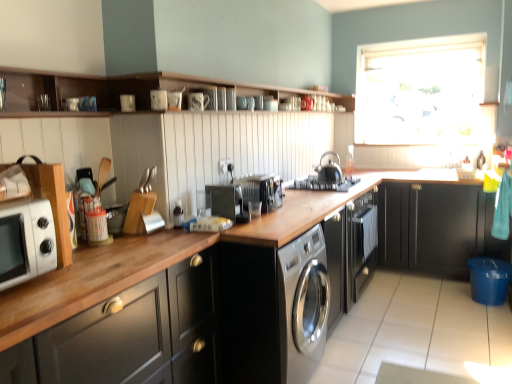
The image size is (512, 384). What do you see at coordinates (227, 203) in the screenshot?
I see `satin black coffee maker at center, positioned as the 1th appliance in front-to-back order` at bounding box center [227, 203].

Locate an element on the screen. black matte cabinet at right, the second cabinetry when ordered from top to bottom is located at coordinates pyautogui.click(x=436, y=228).

I want to click on black matte kettle at center, arranged as the third appliance when viewed from the front, so click(329, 169).

The width and height of the screenshot is (512, 384). In order to click on white glossy microwave at left in this screenshot , I will do `click(26, 241)`.

The image size is (512, 384). What do you see at coordinates (303, 305) in the screenshot?
I see `sleek stainless steel washing machine at center` at bounding box center [303, 305].

The width and height of the screenshot is (512, 384). What do you see at coordinates (50, 89) in the screenshot? I see `wooden shelf at upper left` at bounding box center [50, 89].

This screenshot has height=384, width=512. I want to click on matte wood cabinet at left, acting as the third cabinetry starting from the right, so click(130, 336).

Is black matte kettle at center, arranged as the third appliance when viewed from the left, aimed at black matte cabinet at right, positioned as the third cabinetry in left-to-right order?

No, black matte kettle at center, arranged as the third appliance when viewed from the left, is not oriented towards black matte cabinet at right, positioned as the third cabinetry in left-to-right order.

From the image's perspective, is black matte kettle at center, the first appliance from the right, above or below black matte cabinet at right, the second cabinetry when ordered from top to bottom?

From the image's perspective, black matte kettle at center, the first appliance from the right, appears above black matte cabinet at right, the second cabinetry when ordered from top to bottom.

Can you tell me how much black matte kettle at center, arranged as the third appliance when viewed from the front, and black matte cabinet at right, the second cabinetry when ordered from top to bottom, differ in facing direction?

The angle between the facing direction of black matte kettle at center, arranged as the third appliance when viewed from the front, and the facing direction of black matte cabinet at right, the second cabinetry when ordered from top to bottom, is 83 degrees.

Is wooden shelf at upper left far from satin black coffee maker at center, which is counted as the 1th appliance, starting from the left?

wooden shelf at upper left is actually quite close to satin black coffee maker at center, which is counted as the 1th appliance, starting from the left.

Find the location of a particular element. shelf that appears in front of the satin black coffee maker at center, acting as the third appliance starting from the back is located at coordinates (50, 89).

Is wooden shelf at upper left not inside satin black coffee maker at center, the 3th appliance when ordered from right to left?

wooden shelf at upper left is positioned outside satin black coffee maker at center, the 3th appliance when ordered from right to left.

I want to click on shelf that is in front of the black matte cabinet at right, acting as the second cabinetry starting from the bottom, so click(x=50, y=89).

From the image's perspective, which one is positioned lower, wooden shelf at upper left or black matte cabinet at right, positioned as the third cabinetry in left-to-right order?

From the image's view, black matte cabinet at right, positioned as the third cabinetry in left-to-right order, is below.

From the picture: Can you tell me how much wooden shelf at upper left and black matte cabinet at right, acting as the second cabinetry starting from the bottom, differ in facing direction?

They differ by 91 degrees in their facing directions.

From a real-world perspective, which object rests below the other?

matte wood cabinet at left, arranged as the 3th cabinetry when viewed from the top.

Could matte wood cabinet at left, acting as the third cabinetry starting from the right, be considered to be inside white glossy shelves at upper center, marked as the second cabinetry in a left-to-right arrangement?

That's incorrect, matte wood cabinet at left, acting as the third cabinetry starting from the right, is not inside white glossy shelves at upper center, marked as the second cabinetry in a left-to-right arrangement.

Does white glossy shelves at upper center, marked as the second cabinetry in a left-to-right arrangement, come behind matte wood cabinet at left, the 1th cabinetry from the bottom?

Yes, the depth of white glossy shelves at upper center, marked as the second cabinetry in a left-to-right arrangement, is greater than that of matte wood cabinet at left, the 1th cabinetry from the bottom.

How many degrees apart are the facing directions of white glossy shelves at upper center, arranged as the 3th cabinetry when ordered from the bottom, and matte wood cabinet at left, arranged as the 3th cabinetry when viewed from the top?

The angular difference between white glossy shelves at upper center, arranged as the 3th cabinetry when ordered from the bottom, and matte wood cabinet at left, arranged as the 3th cabinetry when viewed from the top, is 1.58 degrees.

Is white glossy shelves at upper center, acting as the first cabinetry starting from the top, positioned beyond the bounds of satin black stove at center?

Yes, white glossy shelves at upper center, acting as the first cabinetry starting from the top, is located beyond the bounds of satin black stove at center.

From a real-world perspective, is white glossy shelves at upper center, arranged as the 3th cabinetry when ordered from the bottom, above or below satin black stove at center?

In terms of real-world spatial position, white glossy shelves at upper center, arranged as the 3th cabinetry when ordered from the bottom, is above satin black stove at center.

Considering the relative sizes of matte wood cabinet at left, the 1th cabinetry from the bottom, and satin black coffee maker at center, which is counted as the 1th appliance, starting from the left, in the image provided, is matte wood cabinet at left, the 1th cabinetry from the bottom, thinner than satin black coffee maker at center, which is counted as the 1th appliance, starting from the left,?

No, matte wood cabinet at left, the 1th cabinetry from the bottom, is not thinner than satin black coffee maker at center, which is counted as the 1th appliance, starting from the left.

This screenshot has width=512, height=384. Find the location of `cabinetry that appears on the left of satin black coffee maker at center, which is counted as the 1th appliance, starting from the left`. cabinetry that appears on the left of satin black coffee maker at center, which is counted as the 1th appliance, starting from the left is located at coordinates (130, 336).

Is matte wood cabinet at left, arranged as the 3th cabinetry when viewed from the top, to the left of satin black coffee maker at center, which is counted as the 1th appliance, starting from the left, from the viewer's perspective?

Yes.

Looking at the image, does black matte kettle at center, the first appliance from the right, seem bigger or smaller compared to satin black coffee maker at center, which is counted as the 1th appliance, starting from the left?

Considering their sizes, black matte kettle at center, the first appliance from the right, takes up more space than satin black coffee maker at center, which is counted as the 1th appliance, starting from the left.

Is black matte kettle at center, the first appliance positioned from the back, oriented towards satin black coffee maker at center, positioned as the 1th appliance in front-to-back order?

No, black matte kettle at center, the first appliance positioned from the back, is not facing towards satin black coffee maker at center, positioned as the 1th appliance in front-to-back order.

Can you confirm if black matte kettle at center, arranged as the third appliance when viewed from the left, is taller than satin black coffee maker at center, which is counted as the 1th appliance, starting from the left?

Yes, black matte kettle at center, arranged as the third appliance when viewed from the left, is taller than satin black coffee maker at center, which is counted as the 1th appliance, starting from the left.

This screenshot has height=384, width=512. There is a black matte cabinet at right, positioned as the third cabinetry in left-to-right order. Identify the location of the 3rd appliance above it (from a real-world perspective). (329, 169).

Where is `appliance that is the 3rd object directly below the wooden shelf at upper left (from a real-world perspective)`? appliance that is the 3rd object directly below the wooden shelf at upper left (from a real-world perspective) is located at coordinates (227, 203).

Which object lies nearer to the anchor point matte wood cabinet at left, arranged as the 3th cabinetry when viewed from the top, wooden at center or black matte cabinet at right, the first cabinetry when ordered from right to left?

Based on the image, wooden at center appears to be nearer to matte wood cabinet at left, arranged as the 3th cabinetry when viewed from the top.

Based on their spatial positions, is satin black coffee maker at center, acting as the third appliance starting from the back, or black matte cabinet at right, the first cabinetry when ordered from right to left, further from white sheer curtain at upper right?

The object further to white sheer curtain at upper right is satin black coffee maker at center, acting as the third appliance starting from the back.

When comparing their distances from satin black stove at center, does matte wood cabinet at left, acting as the third cabinetry starting from the right, or black matte cabinet at right, acting as the second cabinetry starting from the bottom, seem further?

matte wood cabinet at left, acting as the third cabinetry starting from the right.

Based on their spatial positions, is satin black stove at center or sleek stainless steel washing machine at center closer to white sheer curtain at upper right?

The object closer to white sheer curtain at upper right is satin black stove at center.

Considering their positions, is satin black coffee maker at center, the 3th appliance when ordered from right to left, positioned further to black matte kettle at center, the first appliance positioned from the back, than satin black stove at center?

Based on the image, satin black coffee maker at center, the 3th appliance when ordered from right to left, appears to be further to black matte kettle at center, the first appliance positioned from the back.

Consider the image. From the image, which object appears to be nearer to wooden shelf at upper left, white sheer curtain at upper right or satin black coffee maker at center, which is counted as the 1th appliance, starting from the left?

The object closer to wooden shelf at upper left is satin black coffee maker at center, which is counted as the 1th appliance, starting from the left.

From the image, which object appears to be nearer to white sheer curtain at upper right, satin black coffee maker at center, positioned as the 1th appliance in front-to-back order, or white glossy microwave at left?

satin black coffee maker at center, positioned as the 1th appliance in front-to-back order, is positioned closer to the anchor white sheer curtain at upper right.

Based on their spatial positions, is wooden shelf at upper left or black matte cabinet at right, positioned as the third cabinetry in left-to-right order, further from black matte kettle at center, arranged as the third appliance when viewed from the front?

wooden shelf at upper left.

You are a GUI agent. You are given a task and a screenshot of the screen. Output one action in this format:
    pyautogui.click(x=<x>, y=<y>)
    Task: Click on the washing machine situated between matte wood cabinet at left, acting as the third cabinetry starting from the right, and black matte cabinet at right, the second cabinetry when ordered from top to bottom, from left to right
    
    Given the screenshot: What is the action you would take?
    pyautogui.click(x=303, y=305)

Image resolution: width=512 pixels, height=384 pixels. What are the coordinates of `cabinetry positioned between matte wood cabinet at left, acting as the third cabinetry starting from the right, and satin black stove at center from near to far` in the screenshot? It's located at (x=126, y=89).

Identify the location of shelf situated between white glossy microwave at left and wooden at center from left to right. (50, 89).

At what (x,y) coordinates should I click in order to perform the action: click on stove between wooden at center and black matte kettle at center, the first appliance from the right, in the front-back direction. Please return your answer as a coordinate pair (x, y). This screenshot has height=384, width=512. Looking at the image, I should click on (322, 184).